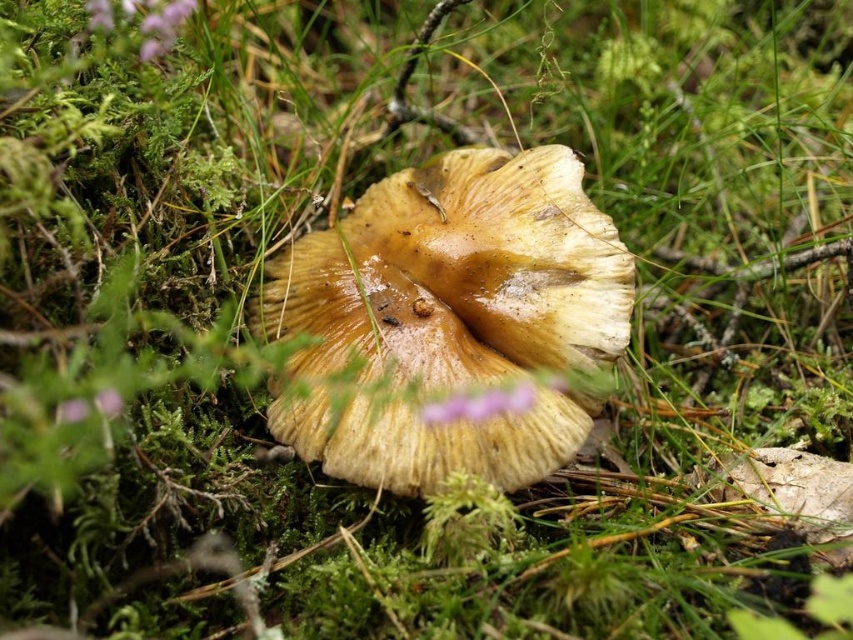
Question: Among these objects, which one is nearest to the camera?

Choices:
 (A) purple matte flower at upper left
 (B) brown textured mushroom at center

Answer: (A)

Question: Does brown textured mushroom at center appear on the left side of purple matte flower at upper left?

Choices:
 (A) yes
 (B) no

Answer: (B)

Question: Can you confirm if brown textured mushroom at center is positioned below purple matte flower at upper left?

Choices:
 (A) no
 (B) yes

Answer: (B)

Question: Which object appears farthest from the camera in this image?

Choices:
 (A) purple matte flower at upper left
 (B) brown textured mushroom at center

Answer: (B)

Question: Does brown textured mushroom at center have a greater width compared to purple matte flower at upper left?

Choices:
 (A) yes
 (B) no

Answer: (A)